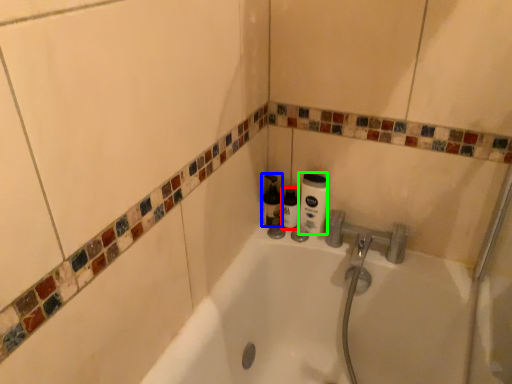
Question: Estimate the real-world distances between objects in this image. Which object is closer to toiletry (highlighted by a red box), bottle (highlighted by a blue box) or cleaning product (highlighted by a green box)?

Choices:
 (A) bottle
 (B) cleaning product

Answer: (A)